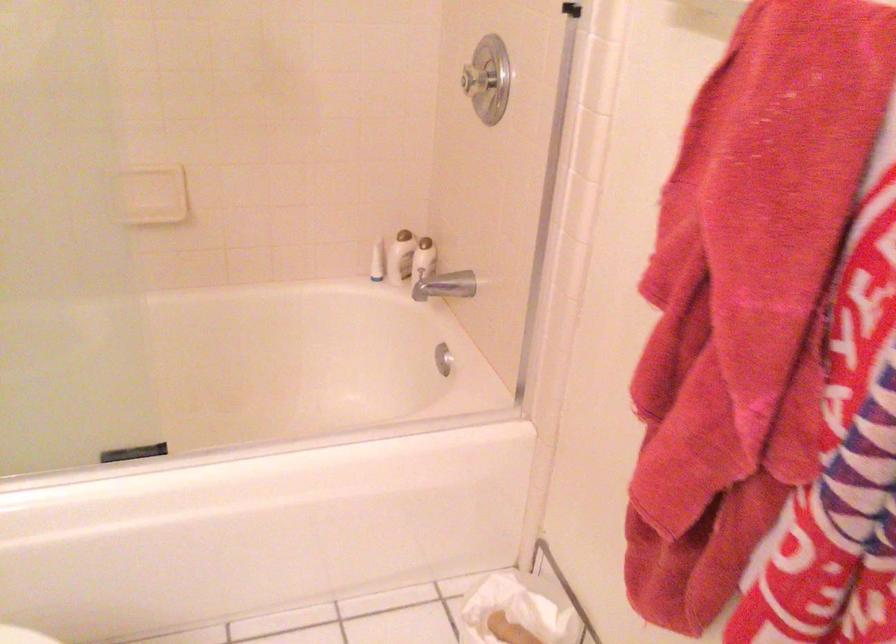
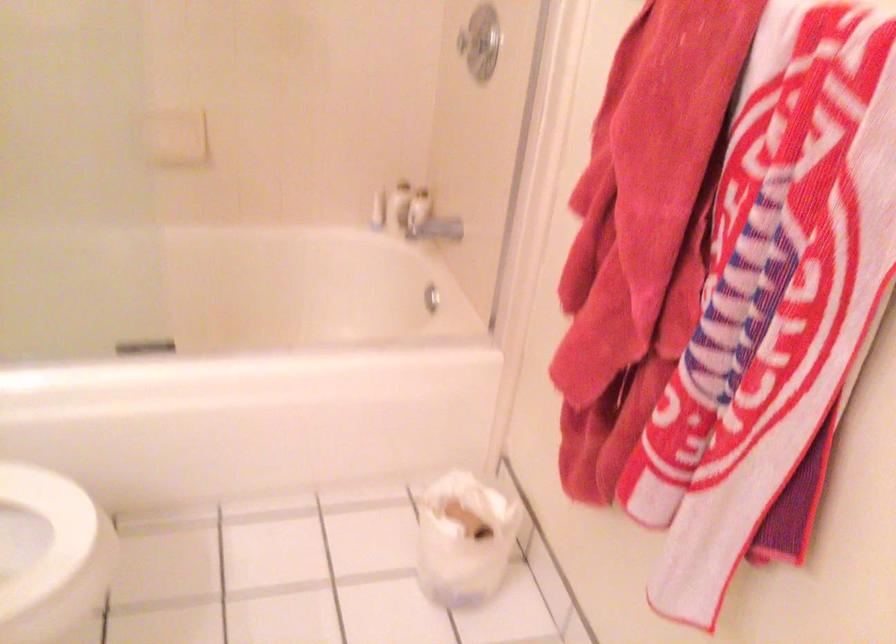
Where in the second image is the point corresponding to (376,267) from the first image?

(378, 211)